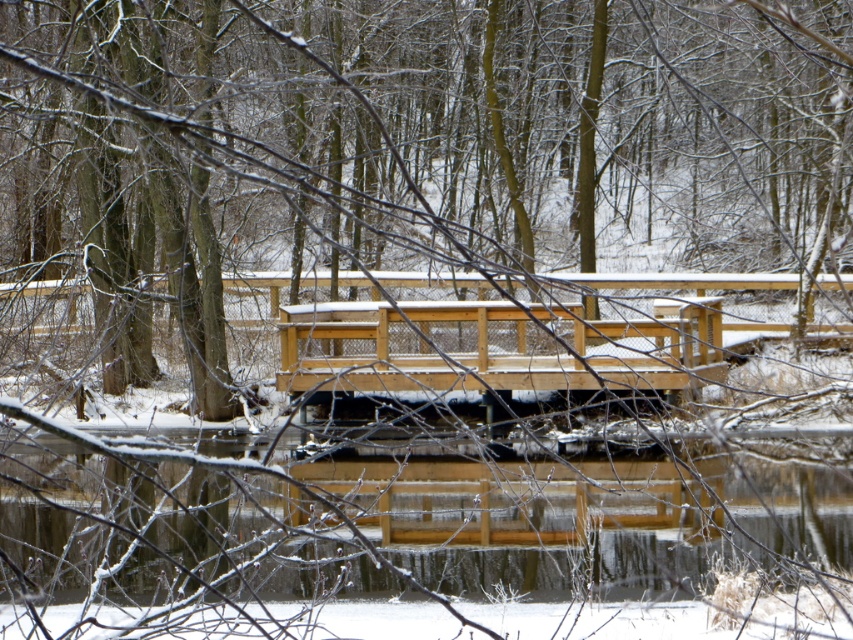
You are standing on the wooden bridge and see the point marked as point (405, 524). What is located at that point?

The point (405, 524) is where the clear water at center is located.

You are a hiker carrying a heavy backpack and want to cross the natural wood bridge at center. The clear water at center flows beneath it. Is the bridge wide enough for you to walk safely without stepping into the water?

The clear water at center might be wider than natural wood bridge at center, so there is a possibility that the bridge may not be wide enough to safely cross without risking stepping into the water. It is advisable to proceed with caution or look for an alternative path.

You are standing on the wooden bridge in the winter scene and want to locate the clear water at center. According to the coordinates provided, where should you look relative to your position?

The clear water at center is located at coordinates point 0.820 on the x axis and 0.477 on the y axis relative to the image frame.